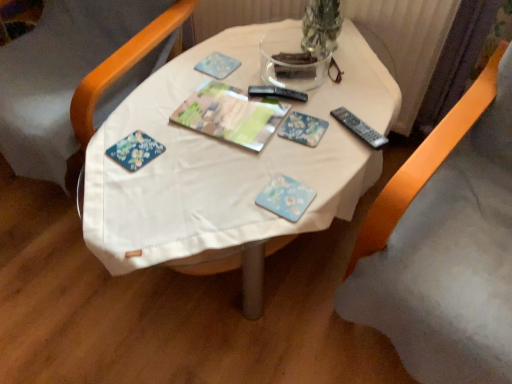
What are the coordinates of `vacant area on top of floral paper magazine at center (from a real-world perspective)` in the screenshot? It's located at (230, 109).